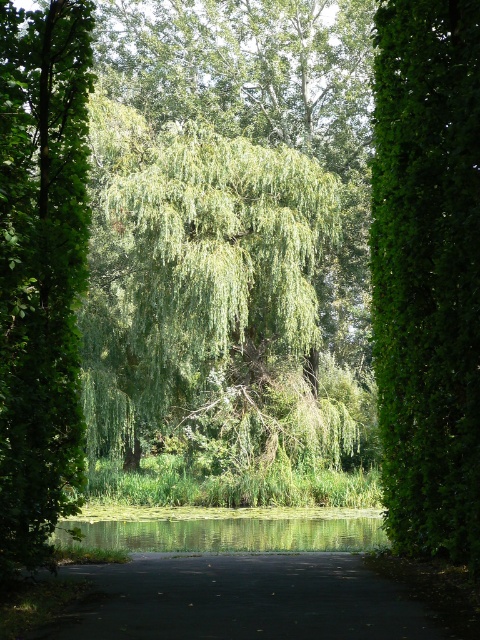
Question: Among these objects, which one is farthest from the camera?

Choices:
 (A) green leafy hedge at right
 (B) green leafy tree at left

Answer: (A)

Question: Which of the following is the closest to the observer?

Choices:
 (A) (267, 220)
 (B) (252, 540)
 (C) (27, 552)

Answer: (C)

Question: In this image, where is green leafy willow at center located relative to green leafy hedge at right?

Choices:
 (A) left
 (B) right

Answer: (A)

Question: Is green leafy willow at center closer to camera compared to green leafy tree at left?

Choices:
 (A) yes
 (B) no

Answer: (B)

Question: Is green leafy willow at center thinner than green leafy hedge at right?

Choices:
 (A) yes
 (B) no

Answer: (B)

Question: Which object appears closest to the camera in this image?

Choices:
 (A) green leafy hedge at right
 (B) green leafy willow at center
 (C) green leafy tree at left
 (D) green reflective water at center

Answer: (C)